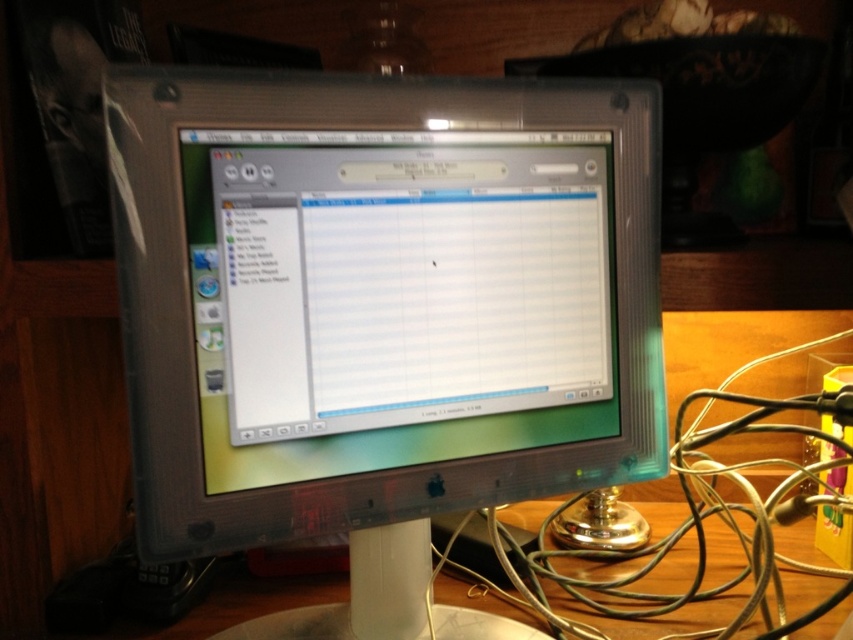
Is clear plastic monitor at center thinner than green metallic wire at right?

Yes, clear plastic monitor at center is thinner than green metallic wire at right.

Is clear plastic monitor at center to the right of green metallic wire at right from the viewer's perspective?

Incorrect, clear plastic monitor at center is not on the right side of green metallic wire at right.

Image resolution: width=853 pixels, height=640 pixels. I want to click on clear plastic monitor at center, so click(378, 310).